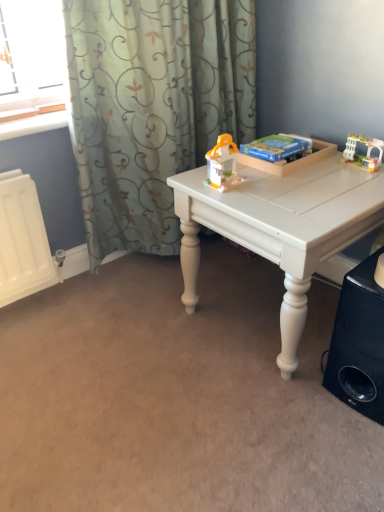
The image size is (384, 512). In order to click on free space on the front side of translucent plastic toy at center, which ranks as the first toy in left-to-right order in this screenshot , I will do `click(246, 202)`.